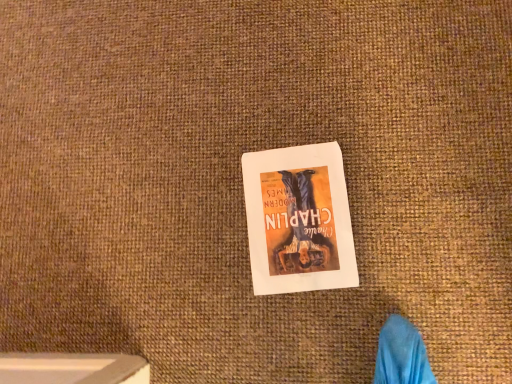
Locate an element on the screen. The image size is (512, 384). white paper at center is located at coordinates (298, 220).

What do you see at coordinates (298, 220) in the screenshot? I see `white paper at center` at bounding box center [298, 220].

Identify the location of white paper at center. The image size is (512, 384). (298, 220).